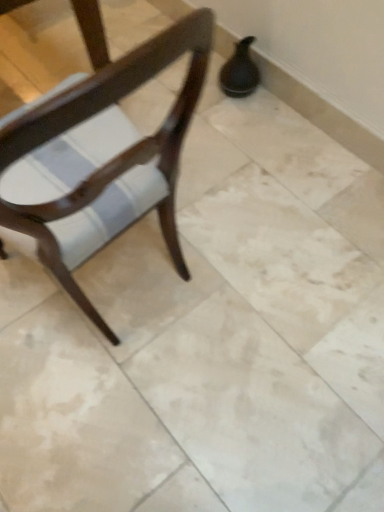
Identify the location of vacant space to the right of wooden chair at center. (243, 273).